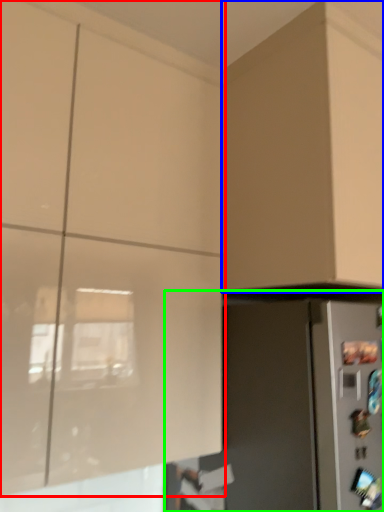
Question: Which object is the farthest from cabinetry (highlighted by a red box)? Choose among these: cabinetry (highlighted by a blue box) or appliance (highlighted by a green box).

Choices:
 (A) cabinetry
 (B) appliance

Answer: (A)